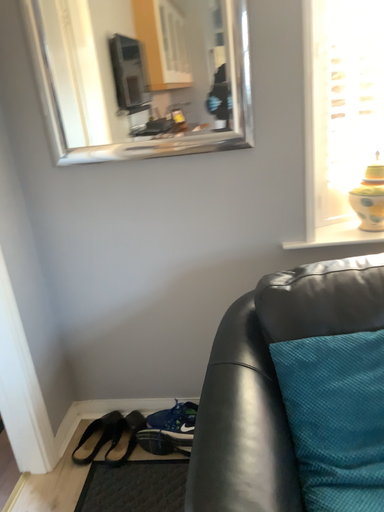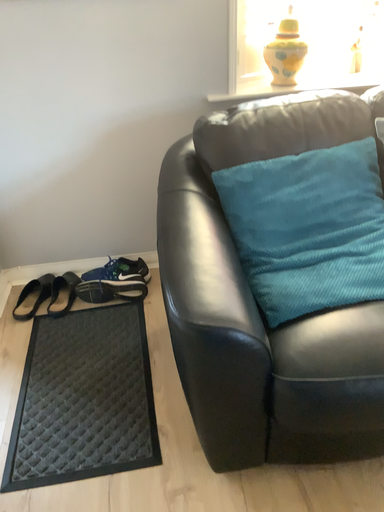
Question: How did the camera likely rotate when shooting the video?

Choices:
 (A) rotated right
 (B) rotated left

Answer: (A)